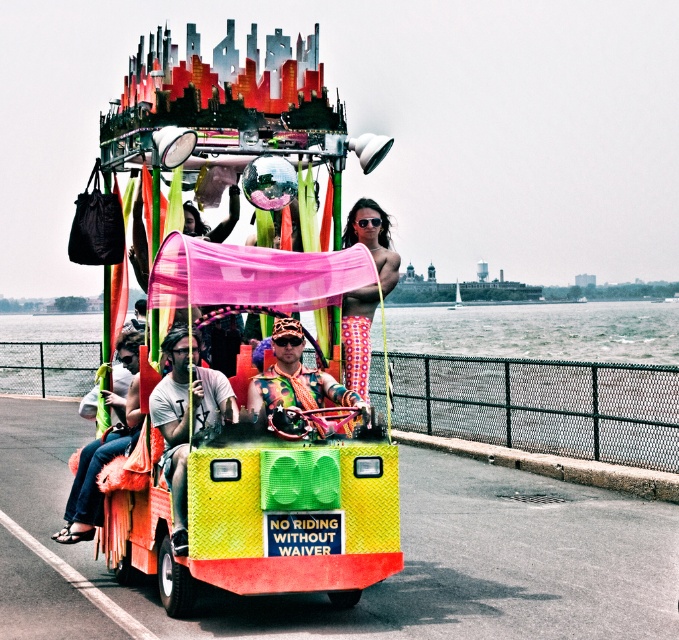
You are standing on the waterfront road and see the decorated vehicle. The vehicle has two items in front of it. One is the translucent plastic water at lower center and the other is the multicolored fabric at center. Which one is positioned to the left?

The translucent plastic water at lower center is positioned to the left of the multicolored fabric at center according to the description.

You are standing on the waterfront road and see the decorated vehicle. Which object is closer to you, the translucent plastic water at lower center or the multicolored fabric at center?

The translucent plastic water at lower center is closer to you because it is further to the viewer than the multicolored fabric at center.